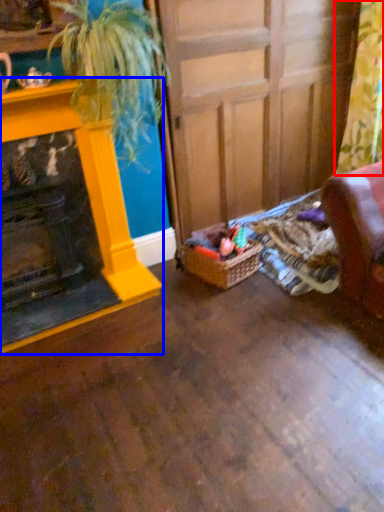
Question: Which point is closer to the camera, curtain (highlighted by a red box) or fireplace (highlighted by a blue box)?

Choices:
 (A) curtain
 (B) fireplace

Answer: (B)